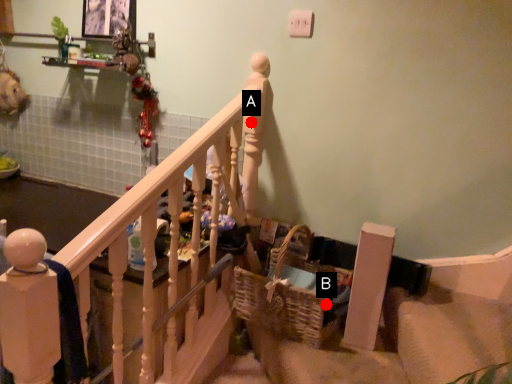
Question: Two points are circled on the image, labeled by A and B beside each circle. Which point is closer to the camera?

Choices:
 (A) A is closer
 (B) B is closer

Answer: (B)